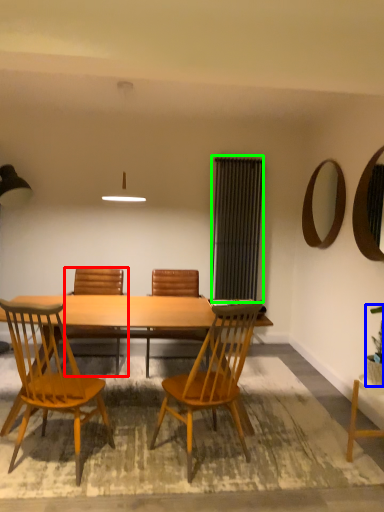
Question: Which object is the farthest from chair (highlighted by a red box)? Choose among these: houseplant (highlighted by a blue box) or screen door (highlighted by a green box).

Choices:
 (A) houseplant
 (B) screen door

Answer: (A)